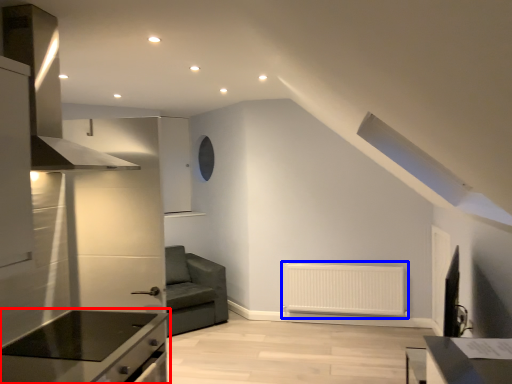
Question: Which object is further to the camera taking this photo, countertop (highlighted by a red box) or radiator (highlighted by a blue box)?

Choices:
 (A) countertop
 (B) radiator

Answer: (B)